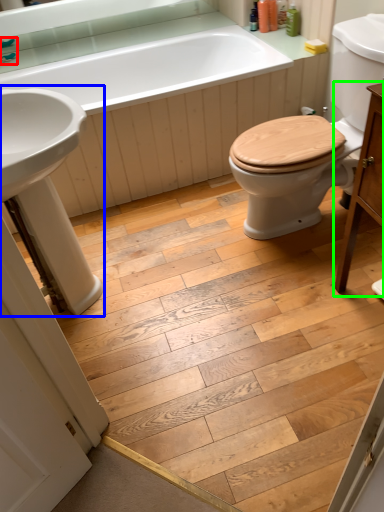
Question: Which object is the closest to the faucet (highlighted by a red box)? Choose among these: sink (highlighted by a blue box) or vanity (highlighted by a green box).

Choices:
 (A) sink
 (B) vanity

Answer: (A)